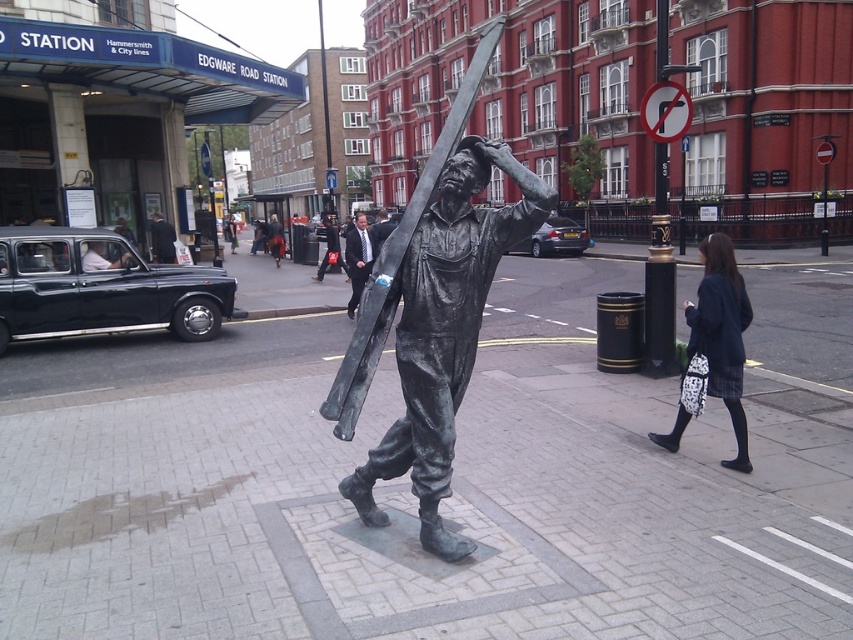
Question: Considering the relative positions of bronze post at center and dark suit at center in the image provided, where is bronze post at center located with respect to dark suit at center?

Choices:
 (A) above
 (B) below

Answer: (A)

Question: Estimate the real-world distances between objects in this image. Which object is farther from the dark blue wool coat at center right?

Choices:
 (A) bronze post at center
 (B) light brown leather jacket at left
 (C) bronze statue of man at center

Answer: (C)

Question: Which point is closer to the camera taking this photo?

Choices:
 (A) click(657, 296)
 (B) click(86, 250)
 (C) click(354, 282)

Answer: (A)

Question: Does dark blue wool coat at center right appear on the left side of bronze post at center?

Choices:
 (A) no
 (B) yes

Answer: (B)

Question: Is dark suit at center smaller than light brown leather jacket at left?

Choices:
 (A) yes
 (B) no

Answer: (B)

Question: Which point is farther to the camera?

Choices:
 (A) (172, 252)
 (B) (674, 330)
 (C) (692, 337)
 (D) (482, 269)

Answer: (A)